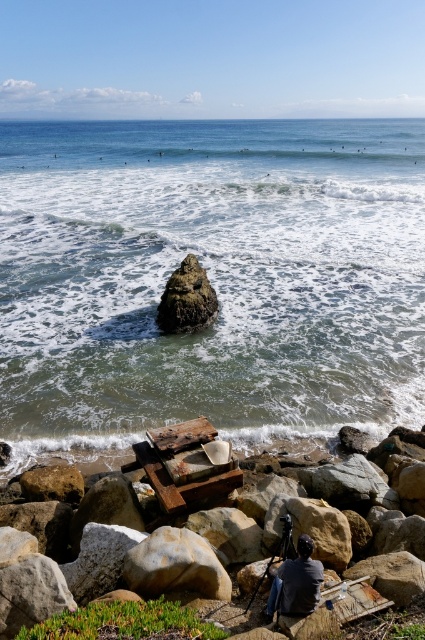
You are standing on the beach and see the greenish water at center and the dark gray fabric at center. Which object is positioned to the left of the other?

The greenish water at center is to the left of dark gray fabric at center.

You are a drone operator trying to capture a photo of the greenish water at center. The drone has a GPS that shows coordinates. What are the coordinates where you should direct the drone to focus?

The greenish water at center is located at point (209,278), so you should direct the drone to focus on those coordinates.